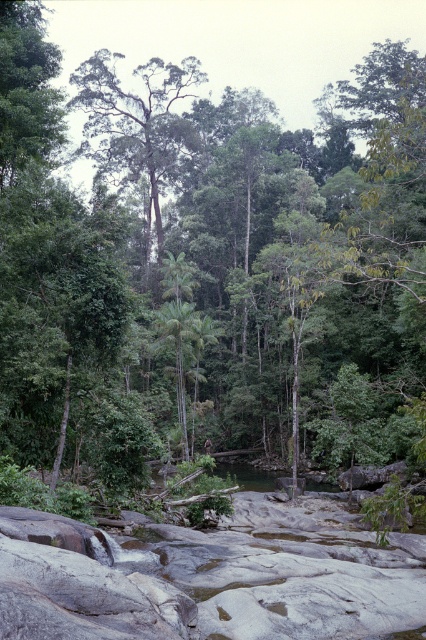
Question: Is green leafy tree at upper center positioned in front of green leafy palm tree at center?

Choices:
 (A) no
 (B) yes

Answer: (A)

Question: Can you confirm if green leafy tree at upper center is positioned above green leafy palm tree at center?

Choices:
 (A) no
 (B) yes

Answer: (B)

Question: Among these objects, which one is farthest from the camera?

Choices:
 (A) green leafy tree at upper center
 (B) green leafy palm tree at center

Answer: (A)

Question: Is green leafy tree at upper center above green leafy palm tree at center?

Choices:
 (A) no
 (B) yes

Answer: (B)

Question: Which point is closer to the camera?

Choices:
 (A) green leafy palm tree at center
 (B) green leafy tree at upper center

Answer: (A)